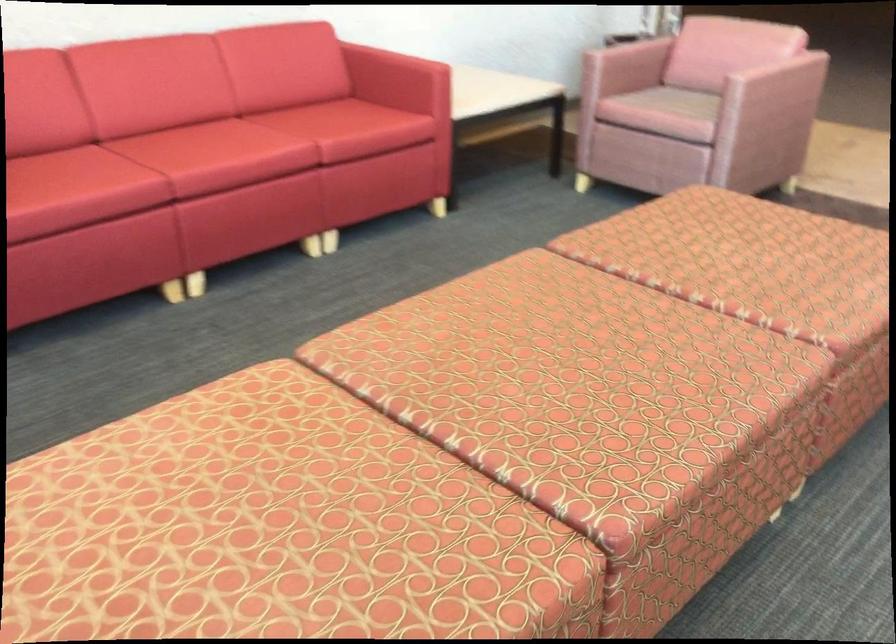
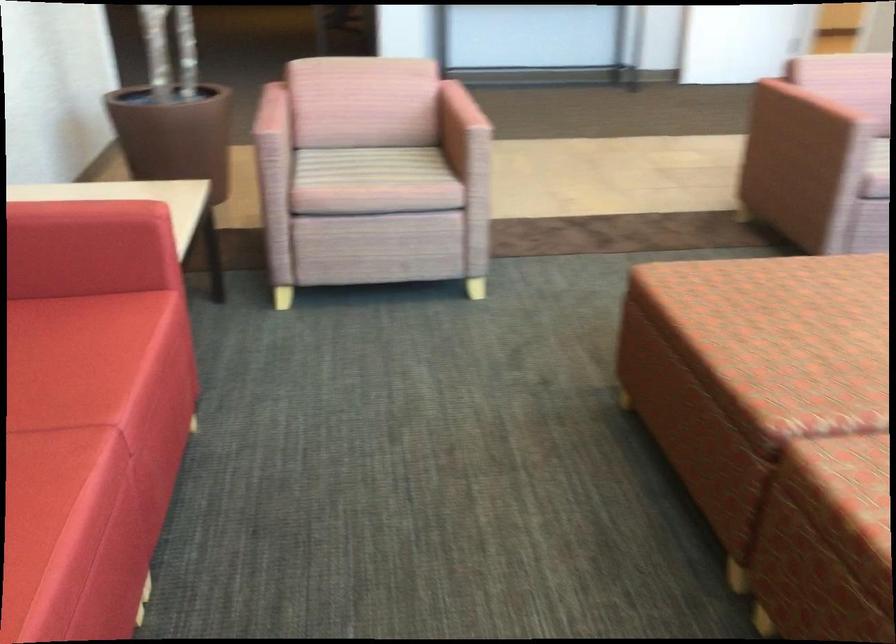
Locate, in the second image, the point that corresponds to point 754,236 in the first image.

(805, 304)